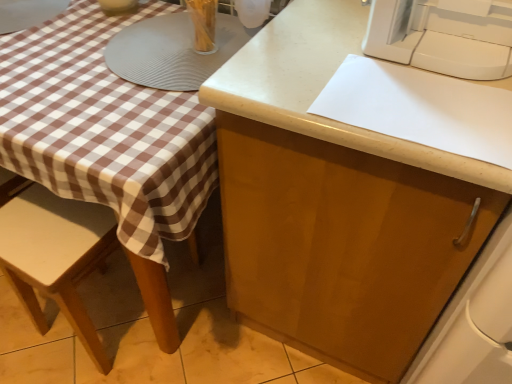
Question: From a real-world perspective, is wooden chair at lower left above or below matte wood cabinet at center?

Choices:
 (A) below
 (B) above

Answer: (A)

Question: Considering their positions, is wooden chair at lower left located in front of or behind matte wood cabinet at center?

Choices:
 (A) front
 (B) behind

Answer: (B)

Question: Based on their relative distances, which object is nearer to the wooden chair at lower left?

Choices:
 (A) white plastic sewing machine at upper right
 (B) matte wood cabinet at center

Answer: (B)

Question: Which object is the farthest from the white plastic sewing machine at upper right?

Choices:
 (A) matte wood cabinet at center
 (B) wooden chair at lower left

Answer: (B)